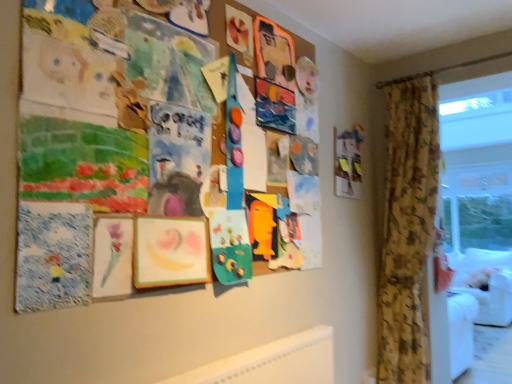
Question: In terms of width, does wooden picture frame at upper right look wider or thinner when compared to transparent plastic window screen at right?

Choices:
 (A) thin
 (B) wide

Answer: (A)

Question: Is wooden picture frame at upper right in front of or behind transparent plastic window screen at right in the image?

Choices:
 (A) front
 (B) behind

Answer: (A)

Question: Considering the real-world distances, which object is closest to the transparent plastic window screen at right?

Choices:
 (A) wooden picture frame at upper right
 (B) white fabric couch at right
 (C) floral fabric curtain at right

Answer: (B)

Question: Which is nearer to the floral fabric curtain at right?

Choices:
 (A) wooden picture frame at upper right
 (B) transparent plastic window screen at right
 (C) white fabric couch at right

Answer: (A)